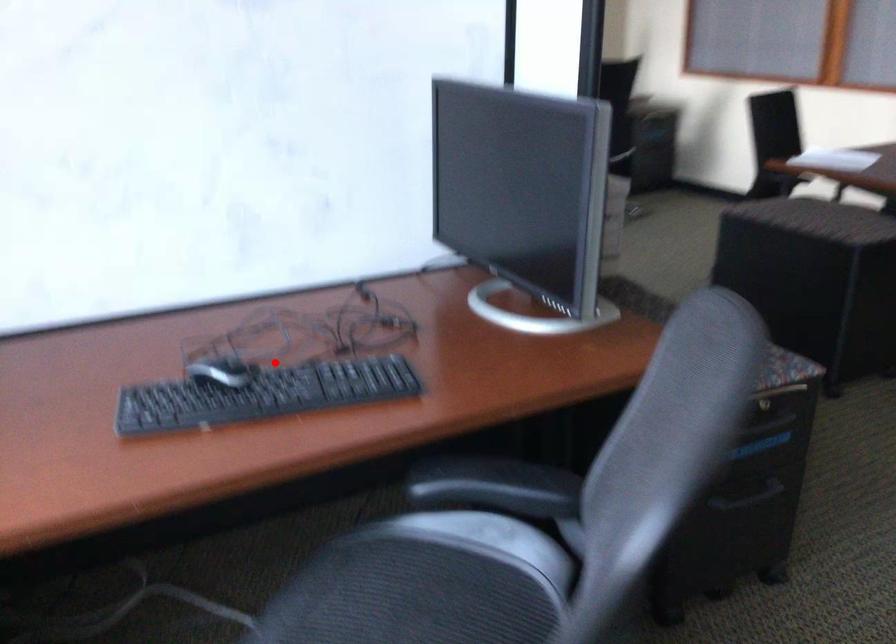
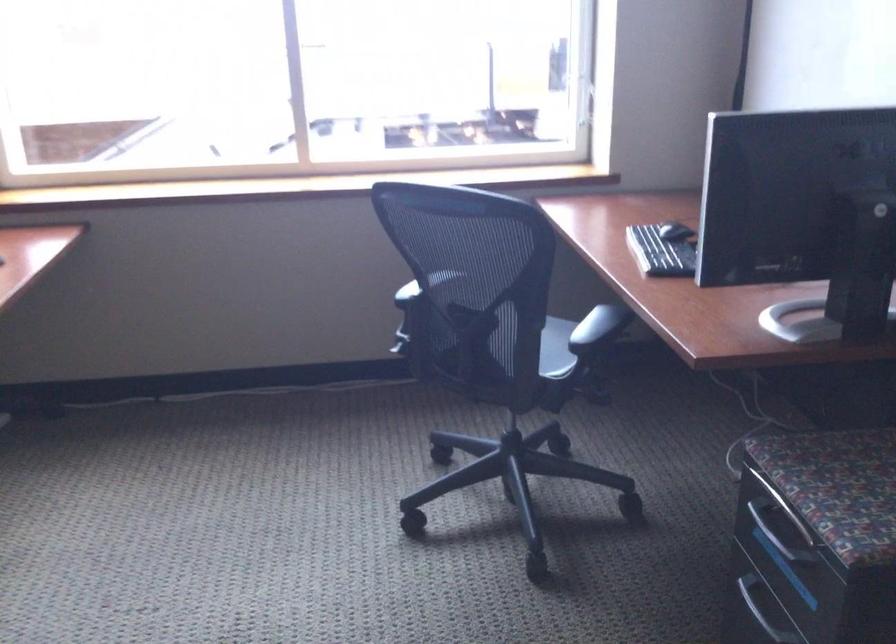
Question: I am providing you with two images of the same scene from different viewpoints. A red point is marked on the first image. Can you still see the location of the red point in image 2?

Choices:
 (A) Yes
 (B) No

Answer: (A)